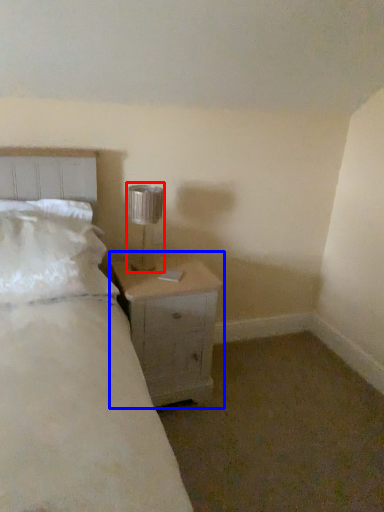
Question: Which object appears closest to the camera in this image, lamp (highlighted by a red box) or nightstand (highlighted by a blue box)?

Choices:
 (A) lamp
 (B) nightstand

Answer: (B)